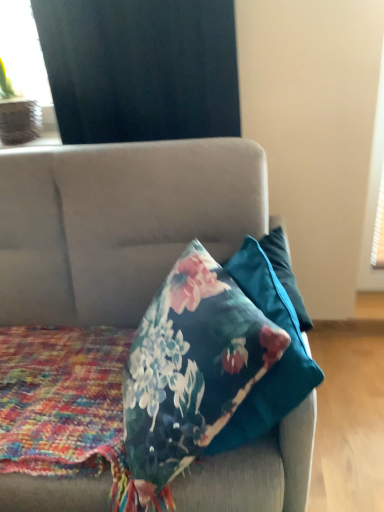
Question: Considering the relative sizes of matte black curtain at upper left and floral-patterned fabric at center in the image provided, is matte black curtain at upper left bigger than floral-patterned fabric at center?

Choices:
 (A) yes
 (B) no

Answer: (B)

Question: From a real-world perspective, is matte black curtain at upper left located beneath floral-patterned fabric at center?

Choices:
 (A) no
 (B) yes

Answer: (A)

Question: Would you say matte black curtain at upper left is outside floral-patterned fabric at center?

Choices:
 (A) yes
 (B) no

Answer: (A)

Question: From a real-world perspective, is matte black curtain at upper left on floral-patterned fabric at center?

Choices:
 (A) no
 (B) yes

Answer: (B)

Question: Is matte black curtain at upper left positioned before floral-patterned fabric at center?

Choices:
 (A) yes
 (B) no

Answer: (B)

Question: Is velvet floral pillow at center inside the boundaries of floral-patterned fabric at center, or outside?

Choices:
 (A) outside
 (B) inside

Answer: (A)

Question: Is point (168, 211) closer or farther from the camera than point (89, 467)?

Choices:
 (A) closer
 (B) farther

Answer: (B)

Question: Looking at the image, does velvet floral pillow at center seem bigger or smaller compared to floral-patterned fabric at center?

Choices:
 (A) big
 (B) small

Answer: (A)

Question: Is velvet floral pillow at center in front of or behind floral-patterned fabric at center in the image?

Choices:
 (A) front
 (B) behind

Answer: (A)

Question: Based on their sizes in the image, would you say matte black curtain at upper left is bigger or smaller than floral-patterned fabric at center?

Choices:
 (A) small
 (B) big

Answer: (A)

Question: From the image's perspective, is matte black curtain at upper left above or below floral-patterned fabric at center?

Choices:
 (A) above
 (B) below

Answer: (A)

Question: Is matte black curtain at upper left inside the boundaries of floral-patterned fabric at center, or outside?

Choices:
 (A) inside
 (B) outside

Answer: (B)

Question: Is point (36, 73) positioned closer to the camera than point (135, 489)?

Choices:
 (A) closer
 (B) farther

Answer: (B)

Question: From the image's perspective, is black matte curtain at upper left above or below velvet floral pillow at center?

Choices:
 (A) above
 (B) below

Answer: (A)

Question: Does point (231, 28) appear closer or farther from the camera than point (306, 496)?

Choices:
 (A) farther
 (B) closer

Answer: (A)